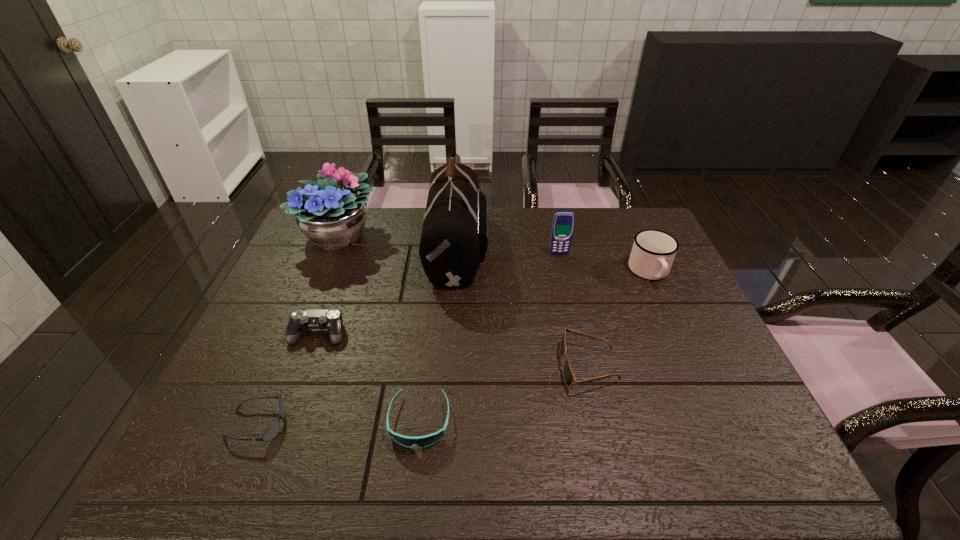
Where is `unoccupied area between the leftmost sunglasses and the duffel bag`? This screenshot has width=960, height=540. unoccupied area between the leftmost sunglasses and the duffel bag is located at coordinates (357, 336).

At what (x,y) coordinates should I click in order to perform the action: click on free space between the fifth shortest object and the second sunglasses from right to left. Please return your answer as a coordinate pair (x, y). This screenshot has height=540, width=960. Looking at the image, I should click on (535, 347).

At what (x,y) coordinates should I click in order to perform the action: click on free space between the fourth tallest object and the second sunglasses from left to right. Please return your answer as a coordinate pair (x, y). The image size is (960, 540). Looking at the image, I should click on (535, 347).

The height and width of the screenshot is (540, 960). I want to click on object that stands as the second closest to the cellular telephone, so click(454, 239).

At what (x,y) coordinates should I click in order to perform the action: click on object that is the second closest to the control. Please return your answer as a coordinate pair (x, y). The width and height of the screenshot is (960, 540). Looking at the image, I should click on (421, 441).

Find the location of a particular element. Image resolution: width=960 pixels, height=540 pixels. sunglasses that stands as the second closest to the tallest object is located at coordinates (421, 441).

Locate which sunglasses is the closest to the rightmost sunglasses. Please provide its 2D coordinates. Your answer should be formatted as a tuple, i.e. [(x, y)], where the tuple contains the x and y coordinates of a point satisfying the conditions above.

[(421, 441)]

Image resolution: width=960 pixels, height=540 pixels. In order to click on vacant position in the image that satisfies the following two spatial constraints: 1. on the side of the fifth shortest object with the handle; 2. on the frames of the rightmost sunglasses in this screenshot , I will do click(692, 366).

I want to click on vacant space that satisfies the following two spatial constraints: 1. on the front-facing side of the cellular telephone; 2. on the lenses of the shortest sunglasses, so click(x=597, y=424).

This screenshot has width=960, height=540. Identify the location of blank area in the image that satisfies the following two spatial constraints: 1. on the front-facing side of the second sunglasses from left to right; 2. on the lenses of the shortest object. (420, 424).